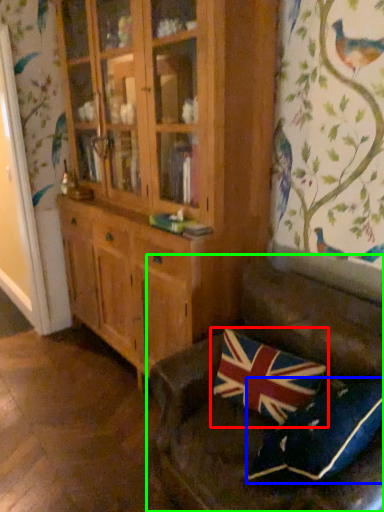
Question: Considering the real-world distances, which object is closest to pillow (highlighted by a red box)? pillow (highlighted by a blue box) or studio couch (highlighted by a green box).

Choices:
 (A) pillow
 (B) studio couch

Answer: (B)